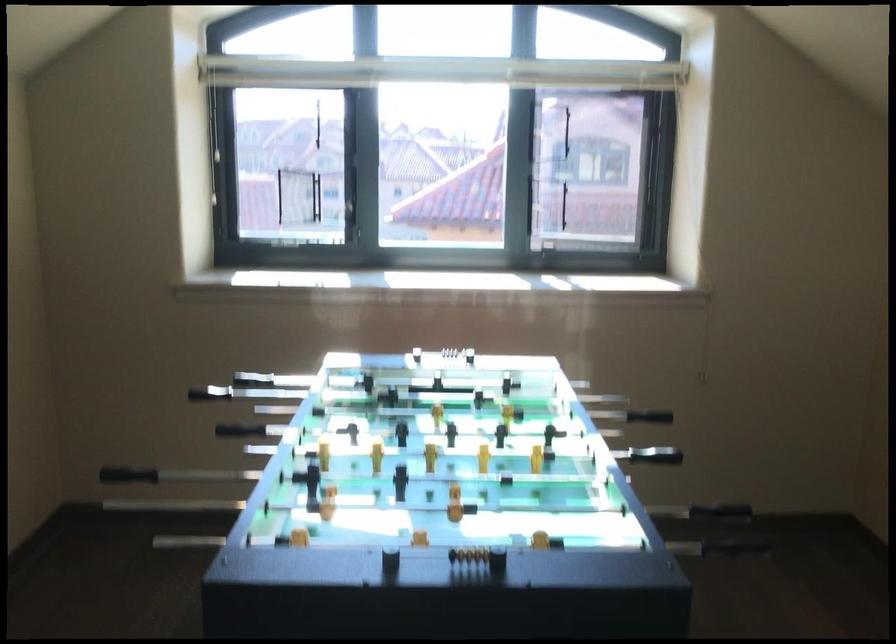
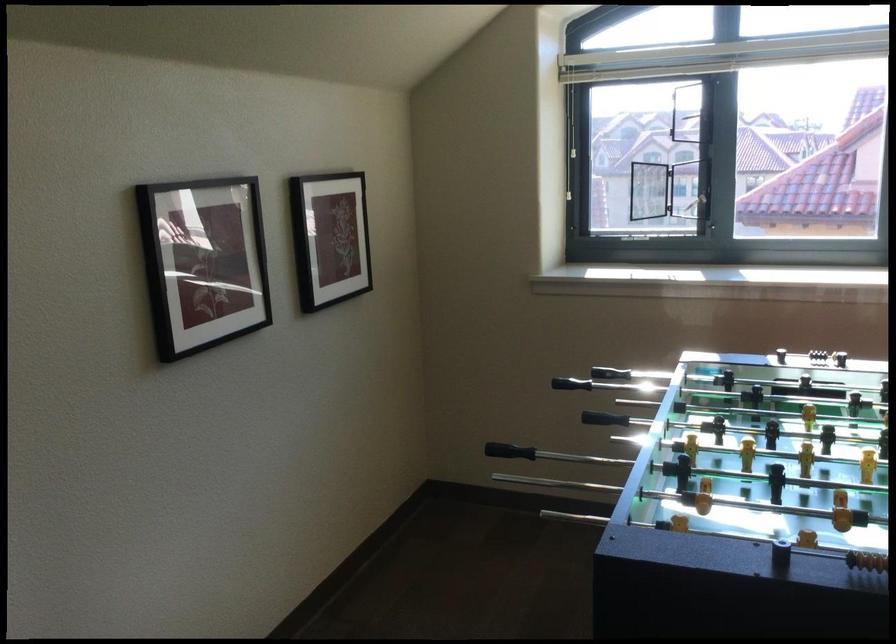
Where in the second image is the point corresponding to [202,138] from the first image?

(567, 138)